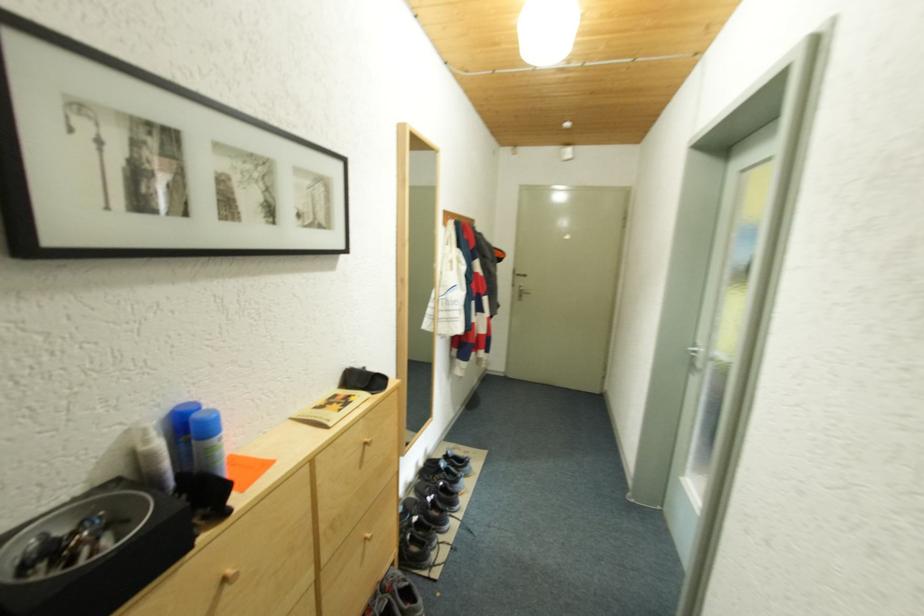
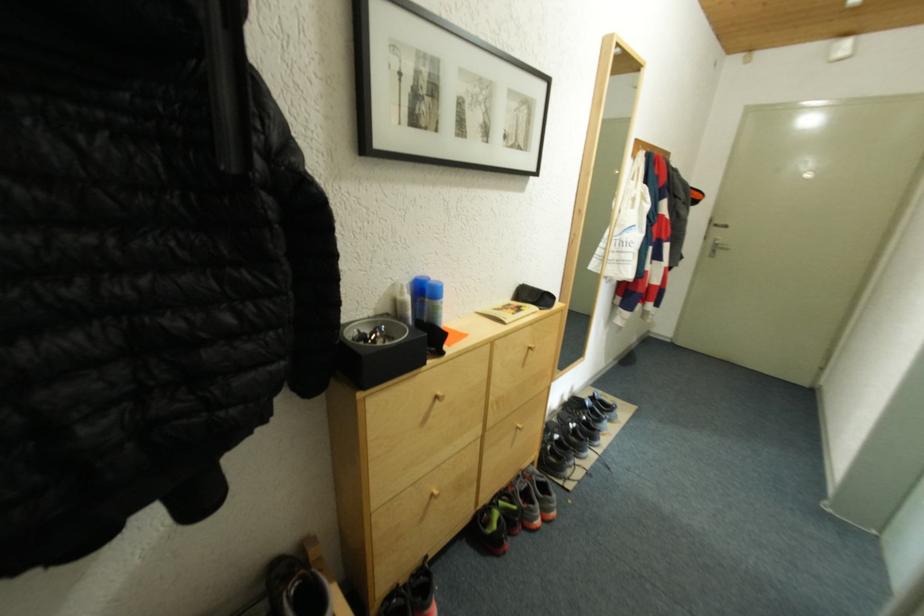
In a continuous first-person perspective shot, in which direction is the camera moving?

The cameraman walked toward left, backward.